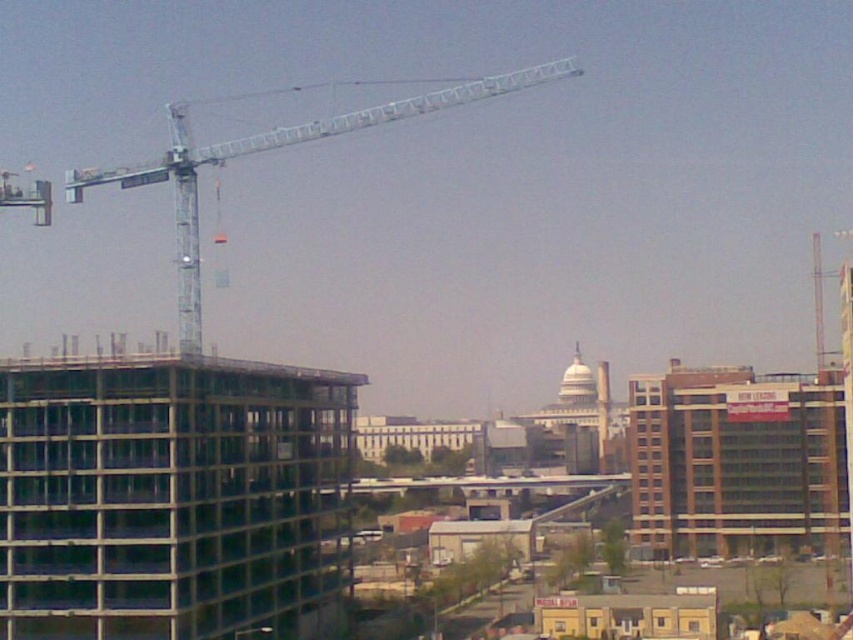
You are a construction worker on the site and need to move a heavy equipment from the metallic glass building at left to the metallic silver crane at upper left. Is the path between them clear? Please explain.

The metallic glass building at left is positioned under the metallic silver crane at upper left, so the path between them is likely blocked by the crane itself. You may need to find an alternative route around the crane.

You are a city planner reviewing a construction site. You notice the metallic glass building at left and the metallic silver crane at upper left. Which structure appears to be larger in the image?

The metallic silver crane at upper left appears larger than the metallic glass building at left in the image.